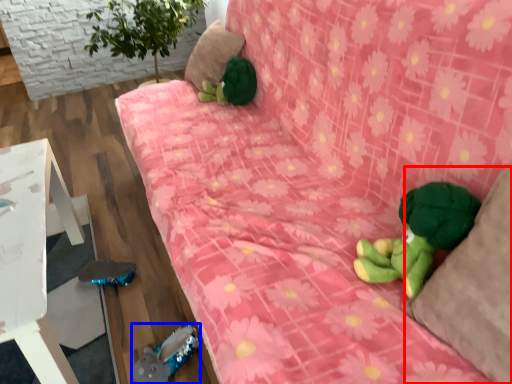
Question: Among these objects, which one is nearest to the camera, pillow (highlighted by a red box) or toy (highlighted by a blue box)?

Choices:
 (A) pillow
 (B) toy

Answer: (A)